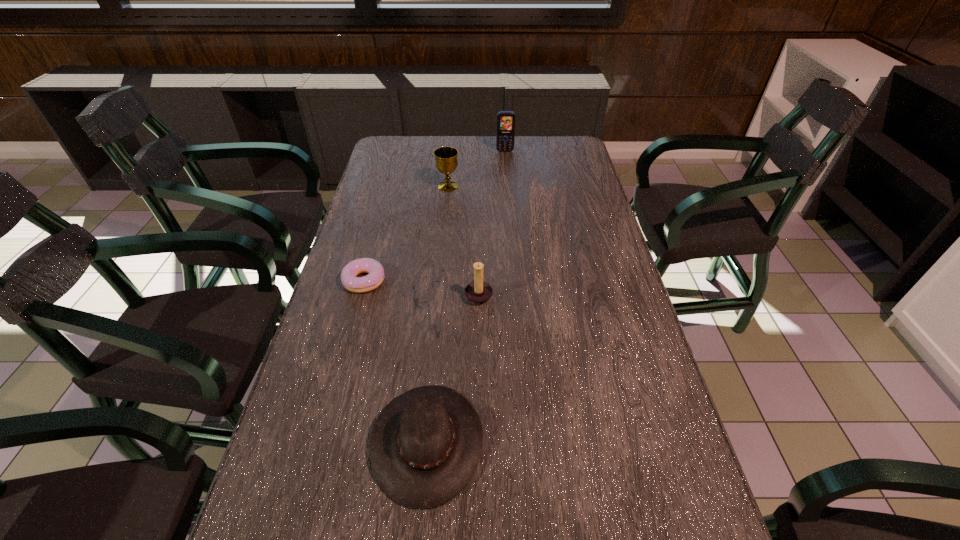
Image resolution: width=960 pixels, height=540 pixels. In order to click on free space located on the wick of the candle holder in this screenshot , I will do `click(558, 294)`.

Locate an element on the screen. The width and height of the screenshot is (960, 540). vacant space situated on the front-facing side of the fourth tallest object is located at coordinates (651, 442).

I want to click on free space located on the right of the leftmost object, so click(x=475, y=281).

This screenshot has height=540, width=960. In order to click on object that is at the far edge in this screenshot , I will do `click(505, 135)`.

Identify the location of object at the left edge. The image size is (960, 540). 367,283.

Identify the location of free location at the left edge of the desktop. Image resolution: width=960 pixels, height=540 pixels. (358, 388).

In order to click on free region at the right edge in this screenshot , I will do `click(657, 373)`.

Where is `vacant space at the far right corner of the desktop`? vacant space at the far right corner of the desktop is located at coordinates (583, 163).

Locate an element on the screen. free space between the candle holder and the chalice is located at coordinates (464, 240).

You are a GUI agent. You are given a task and a screenshot of the screen. Output one action in this format:
    pyautogui.click(x=<x>, y=<y>)
    Task: Click on the free space between the leftmost object and the rightmost object
    This screenshot has width=960, height=540.
    Given the screenshot: What is the action you would take?
    pyautogui.click(x=435, y=216)